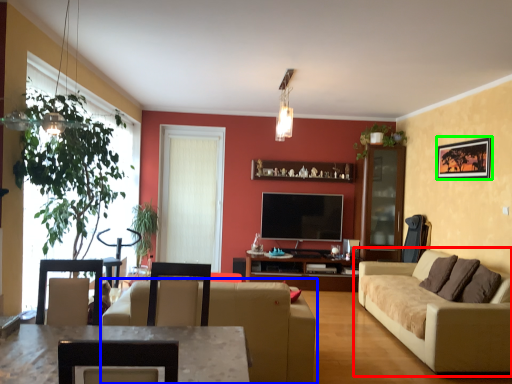
Question: Considering the real-world distances, which object is farthest from studio couch (highlighted by a red box)? studio couch (highlighted by a blue box) or picture frame (highlighted by a green box)?

Choices:
 (A) studio couch
 (B) picture frame

Answer: (B)